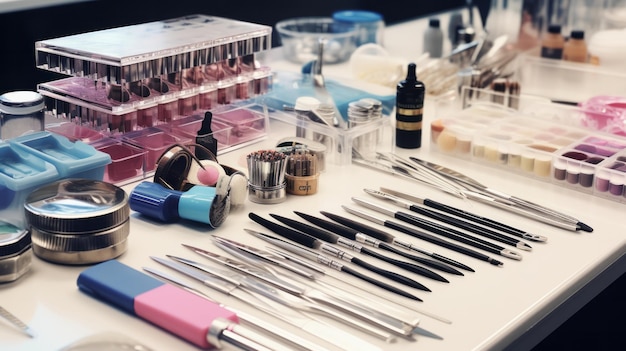
Identify the location of table. (489, 320).